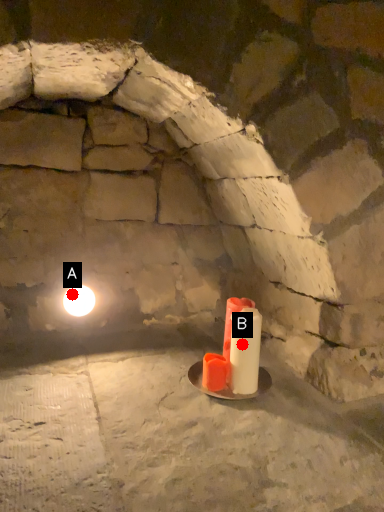
Question: Two points are circled on the image, labeled by A and B beside each circle. Which of the following is the farthest from the observer?

Choices:
 (A) A is further
 (B) B is further

Answer: (A)